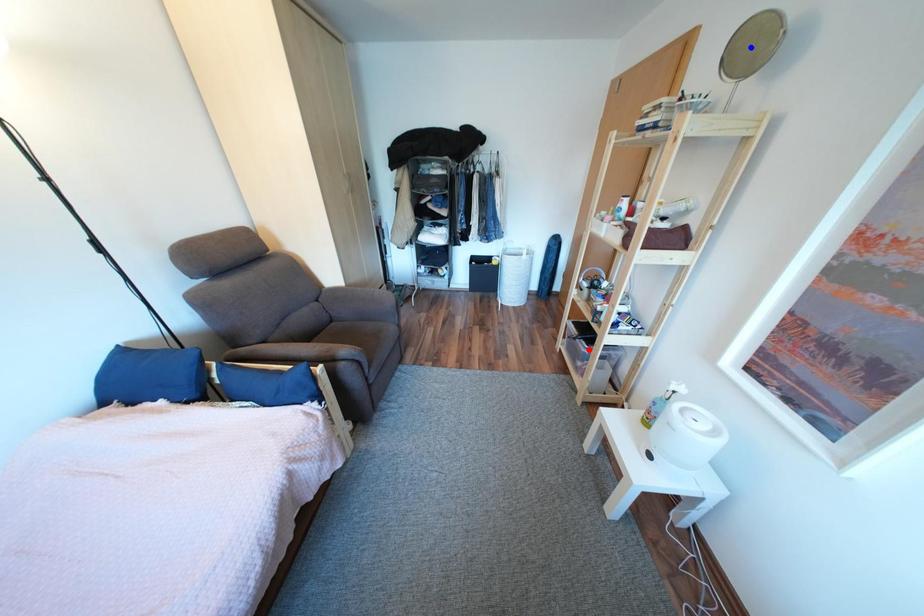
Question: Two points are marked on the image. Which point is closer to the camera?

Choices:
 (A) Blue point is closer.
 (B) Red point is closer.

Answer: (A)